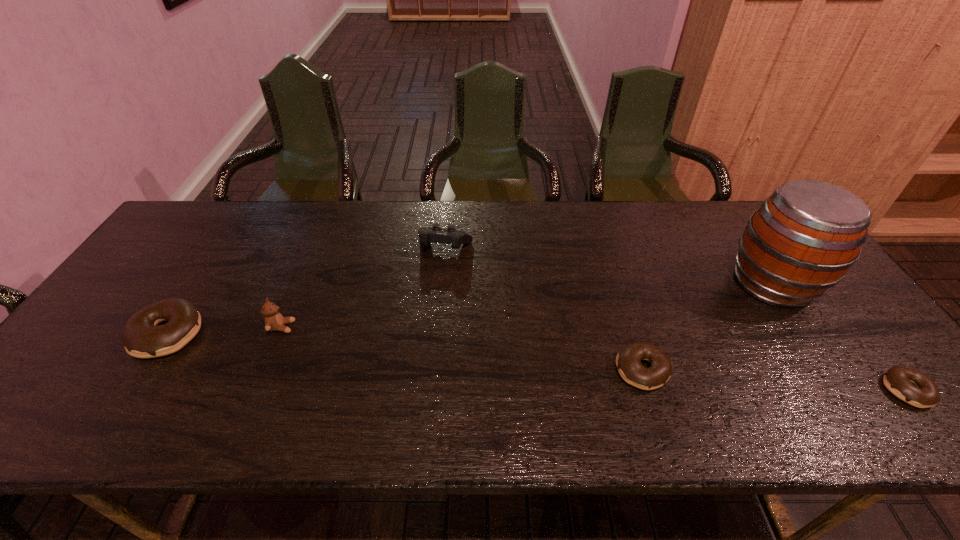
Identify the location of teddy bear. (274, 321).

At what (x,y) coordinates should I click in order to perform the action: click on blank space located 0.120m on the right of the leftmost doughnut. Please return your answer as a coordinate pair (x, y). The height and width of the screenshot is (540, 960). Looking at the image, I should click on (251, 334).

The height and width of the screenshot is (540, 960). I want to click on vacant space located on the left of the second doughnut from right to left, so click(x=504, y=370).

You are a GUI agent. You are given a task and a screenshot of the screen. Output one action in this format:
    pyautogui.click(x=<x>, y=<y>)
    Task: Click on the free space located 0.260m on the left of the shortest object
    The width and height of the screenshot is (960, 540).
    Given the screenshot: What is the action you would take?
    pyautogui.click(x=769, y=390)

At what (x,y) coordinates should I click in order to perform the action: click on vacant space situated on the left of the third tallest object. Please return your answer as a coordinate pair (x, y). This screenshot has width=960, height=540. Looking at the image, I should click on [x=327, y=247].

The height and width of the screenshot is (540, 960). Find the location of `free spot located 0.230m on the front of the tallest object`. free spot located 0.230m on the front of the tallest object is located at coordinates (848, 396).

The width and height of the screenshot is (960, 540). Identify the location of vacant area located 0.220m on the front-facing side of the teddy bear. (380, 327).

The width and height of the screenshot is (960, 540). I want to click on object present at the far edge, so click(436, 234).

Locate an element on the screen. This screenshot has width=960, height=540. object at the left edge is located at coordinates (142, 338).

The height and width of the screenshot is (540, 960). Find the location of `doughnut located at the right edge`. doughnut located at the right edge is located at coordinates (909, 385).